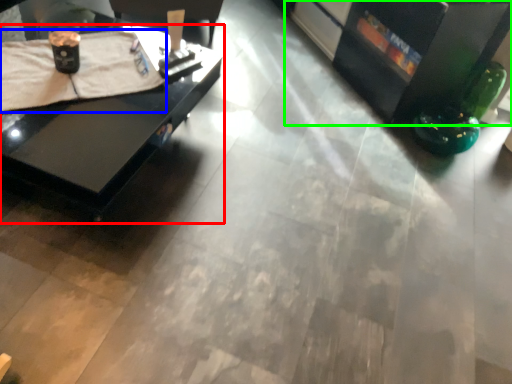
Question: Considering the real-world distances, which object is closest to table (highlighted by a red box)? blanket (highlighted by a blue box) or entertainment center (highlighted by a green box).

Choices:
 (A) blanket
 (B) entertainment center

Answer: (A)